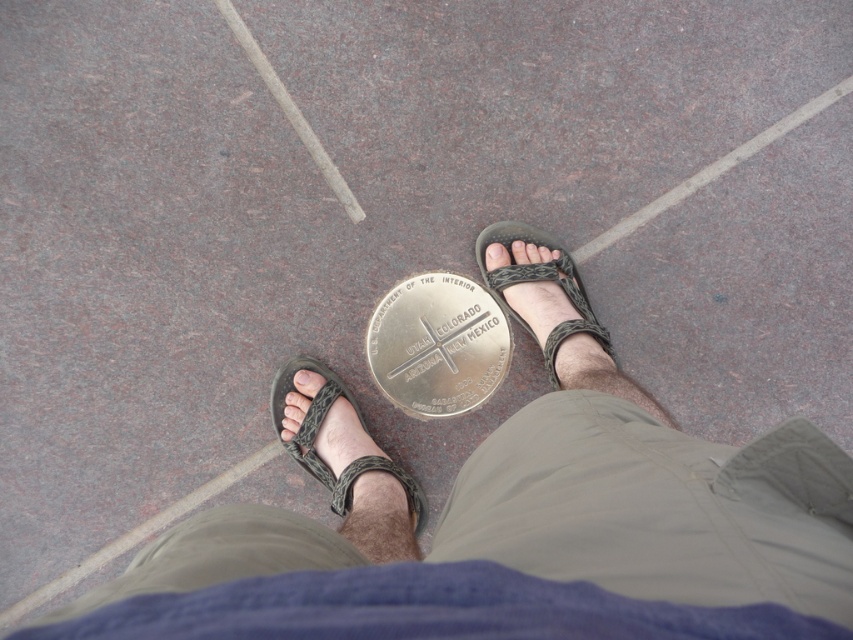
Can you confirm if metallic silver medallion at center is wider than matte gray sandal at center?

Indeed, metallic silver medallion at center has a greater width compared to matte gray sandal at center.

The width and height of the screenshot is (853, 640). Find the location of `metallic silver medallion at center`. metallic silver medallion at center is located at coordinates (512, 516).

Describe the element at coordinates (315, 436) in the screenshot. I see `matte gray sandal at center` at that location.

Does point (399, 476) lie in front of point (556, 352)?

Yes.

Locate an element on the screen. matte gray sandal at center is located at coordinates (315, 436).

In the scene shown: Is matte gray sandal at center bigger than matte black toe at lower left?

Yes, matte gray sandal at center is bigger than matte black toe at lower left.

Is point (334, 502) closer to viewer compared to point (305, 372)?

Yes, it is in front of point (305, 372).

Is point (303, 424) positioned behind point (296, 381)?

No, (303, 424) is in front of (296, 381).

You are a GUI agent. You are given a task and a screenshot of the screen. Output one action in this format:
    pyautogui.click(x=<x>, y=<y>)
    Task: Click on the matte gray sandal at center
    
    Given the screenshot: What is the action you would take?
    pyautogui.click(x=315, y=436)